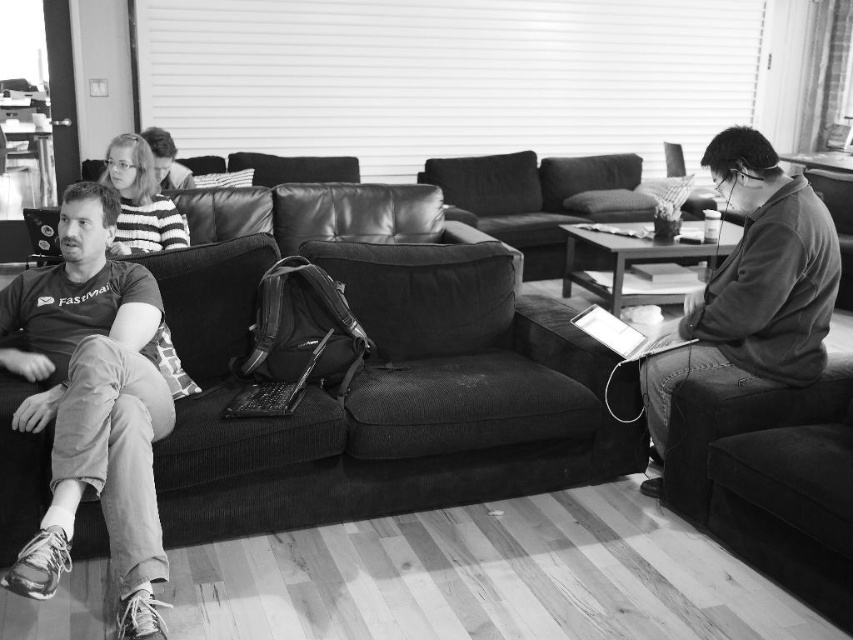
The height and width of the screenshot is (640, 853). I want to click on matte gray t-shirt at left, so click(x=91, y=403).

Is matte gray t-shirt at left below matte black laptop at left?

Yes, matte gray t-shirt at left is below matte black laptop at left.

What do you see at coordinates (91, 403) in the screenshot? The height and width of the screenshot is (640, 853). I see `matte gray t-shirt at left` at bounding box center [91, 403].

Where is `matte gray t-shirt at left`? matte gray t-shirt at left is located at coordinates (91, 403).

Which is above, striped sweater at upper left or matte black laptop at center?

Positioned higher is striped sweater at upper left.

Can you confirm if striped sweater at upper left is thinner than matte black laptop at center?

Incorrect, striped sweater at upper left's width is not less than matte black laptop at center's.

What do you see at coordinates (140, 200) in the screenshot? I see `striped sweater at upper left` at bounding box center [140, 200].

Image resolution: width=853 pixels, height=640 pixels. Find the location of `striped sweater at upper left`. striped sweater at upper left is located at coordinates (140, 200).

Looking at this image, does matte black laptop at center come in front of matte black laptop at left?

Yes, matte black laptop at center is in front of matte black laptop at left.

Who is positioned more to the left, matte black laptop at center or matte black laptop at left?

From the viewer's perspective, matte black laptop at left appears more on the left side.

I want to click on matte black laptop at center, so click(274, 390).

Locate an element on the screen. The height and width of the screenshot is (640, 853). matte black laptop at center is located at coordinates (274, 390).